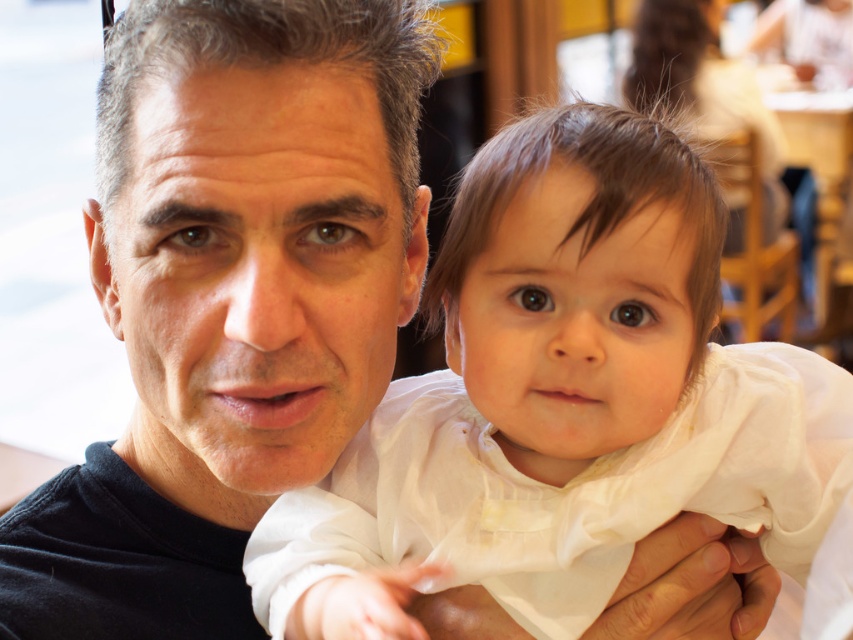
Question: Does white silky dress at center lie in front of black matte shirt at center?

Choices:
 (A) no
 (B) yes

Answer: (B)

Question: Among these points, which one is farthest from the camera?

Choices:
 (A) (132, 195)
 (B) (665, 176)

Answer: (B)

Question: Among these points, which one is farthest from the camera?

Choices:
 (A) (107, 612)
 (B) (358, 548)

Answer: (B)

Question: Can you confirm if white silky dress at center is positioned to the left of black matte shirt at center?

Choices:
 (A) yes
 (B) no

Answer: (B)

Question: Where is white silky dress at center located in relation to black matte shirt at center in the image?

Choices:
 (A) above
 (B) below

Answer: (B)

Question: Which point appears closest to the camera in this image?

Choices:
 (A) (343, 500)
 (B) (317, 452)

Answer: (B)